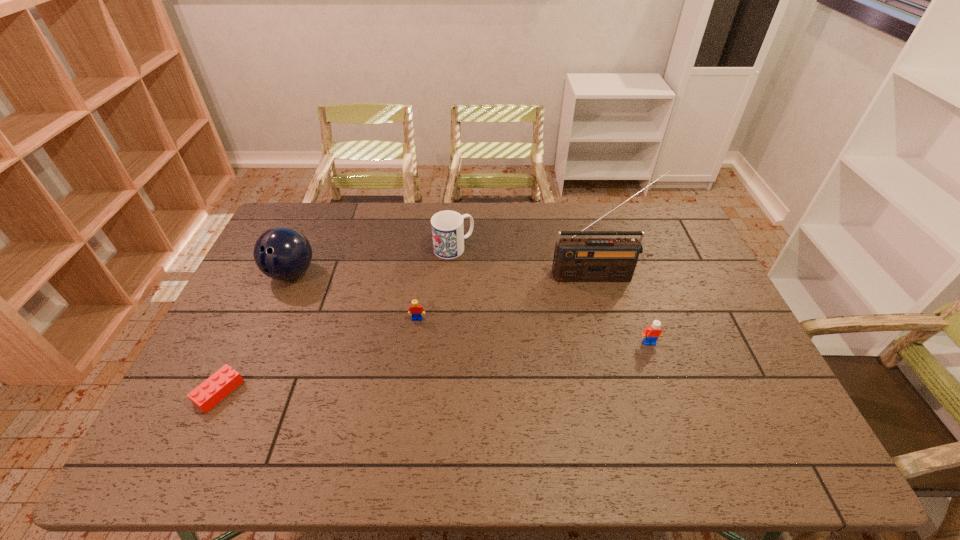
Locate an element on the screen. This screenshot has height=540, width=960. radio receiver is located at coordinates (575, 259).

Find the location of `bowling ball`. bowling ball is located at coordinates (282, 253).

This screenshot has height=540, width=960. Find the location of `the fourth shortest object`. the fourth shortest object is located at coordinates (447, 226).

Find the location of a particular element. This screenshot has width=960, height=540. the fifth farthest object is located at coordinates (651, 334).

At what (x,y) coordinates should I click in order to perform the action: click on the second farthest Lego. Please return your answer as a coordinate pair (x, y). The image size is (960, 540). Looking at the image, I should click on (651, 334).

You are a GUI agent. You are given a task and a screenshot of the screen. Output one action in this format:
    pyautogui.click(x=<x>, y=<y>)
    Task: Click on the third nearest object
    The height and width of the screenshot is (540, 960).
    Given the screenshot: What is the action you would take?
    pyautogui.click(x=415, y=309)

At what (x,y) coordinates should I click in order to perform the action: click on the farthest Lego. Please return your answer as a coordinate pair (x, y). Looking at the image, I should click on (415, 309).

Locate an element on the screen. This screenshot has width=960, height=540. the shortest object is located at coordinates (209, 393).

Identify the location of the leftmost Lego. The height and width of the screenshot is (540, 960). (209, 393).

You are a GUI agent. You are given a task and a screenshot of the screen. Output one action in this format:
    pyautogui.click(x=<x>, y=<y>)
    Task: Click on the free space located 0.230m on the front-facing side of the tallest object
    
    Given the screenshot: What is the action you would take?
    pyautogui.click(x=614, y=340)